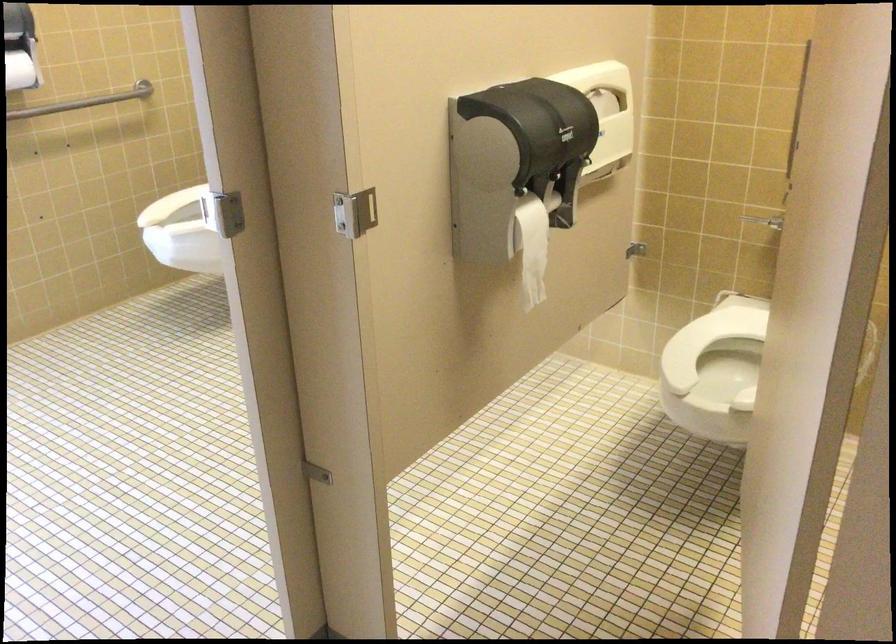
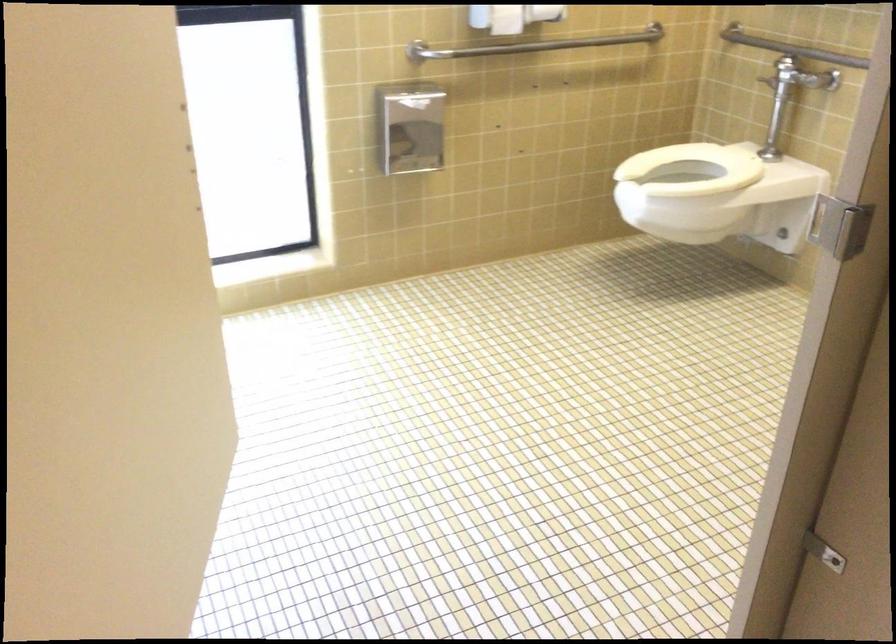
Question: Based on the continuous images, in which direction is the camera rotating? Reply with the corresponding letter.

Choices:
 (A) Left
 (B) Right
 (C) Up
 (D) Down

Answer: (A)